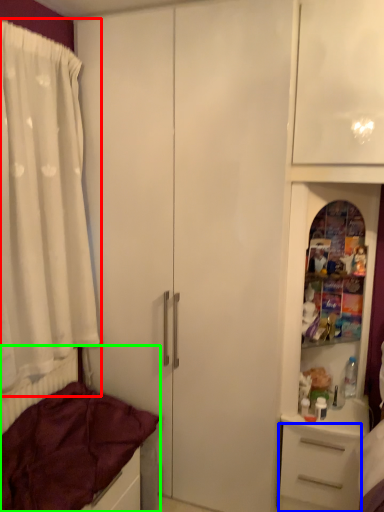
Question: Which object is the farthest from curtain (highlighted by a red box)? Choose among these: drawer (highlighted by a blue box) or bed (highlighted by a green box).

Choices:
 (A) drawer
 (B) bed

Answer: (A)